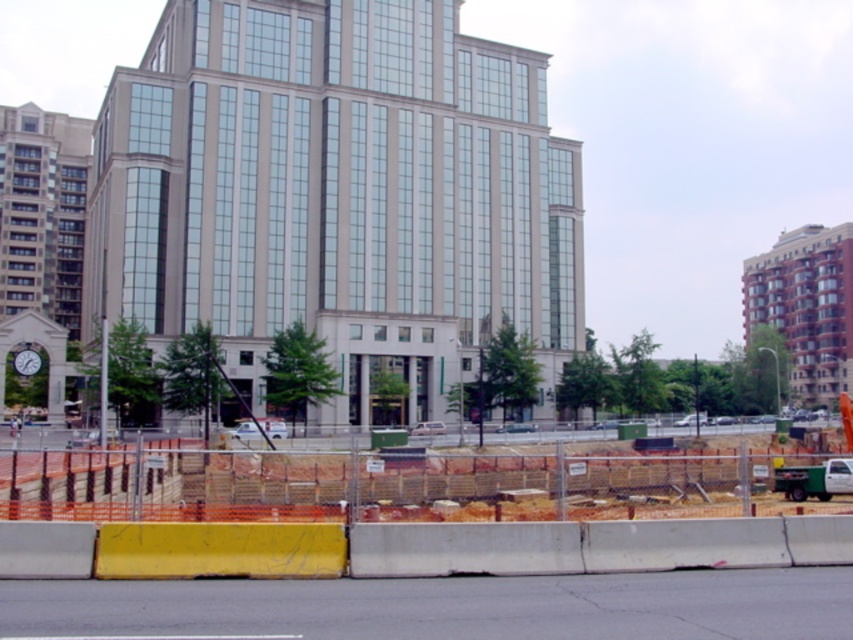
Is point (407, 84) in front of point (18, 435)?

No, it is behind (18, 435).

Is beige glass building at center above white hard hat at center?

Yes.

Is point (447, 19) less distant than point (13, 420)?

No, (447, 19) is further to viewer.

Where is `beige glass building at center`? The image size is (853, 640). beige glass building at center is located at coordinates (338, 195).

Which is more to the left, orange plastic barrier at lower center or white hard hat at center?

From the viewer's perspective, white hard hat at center appears more on the left side.

Is orange plastic barrier at lower center shorter than white hard hat at center?

Incorrect, orange plastic barrier at lower center's height does not fall short of white hard hat at center's.

Find the location of a particular element. The width and height of the screenshot is (853, 640). orange plastic barrier at lower center is located at coordinates (340, 484).

The width and height of the screenshot is (853, 640). What are the coordinates of `orange plastic barrier at lower center` in the screenshot? It's located at (340, 484).

Can you confirm if beige glass building at center is taller than orange plastic barrier at lower center?

Yes, beige glass building at center is taller than orange plastic barrier at lower center.

Is beige glass building at center to the left of orange plastic barrier at lower center from the viewer's perspective?

Correct, you'll find beige glass building at center to the left of orange plastic barrier at lower center.

I want to click on beige glass building at center, so click(x=338, y=195).